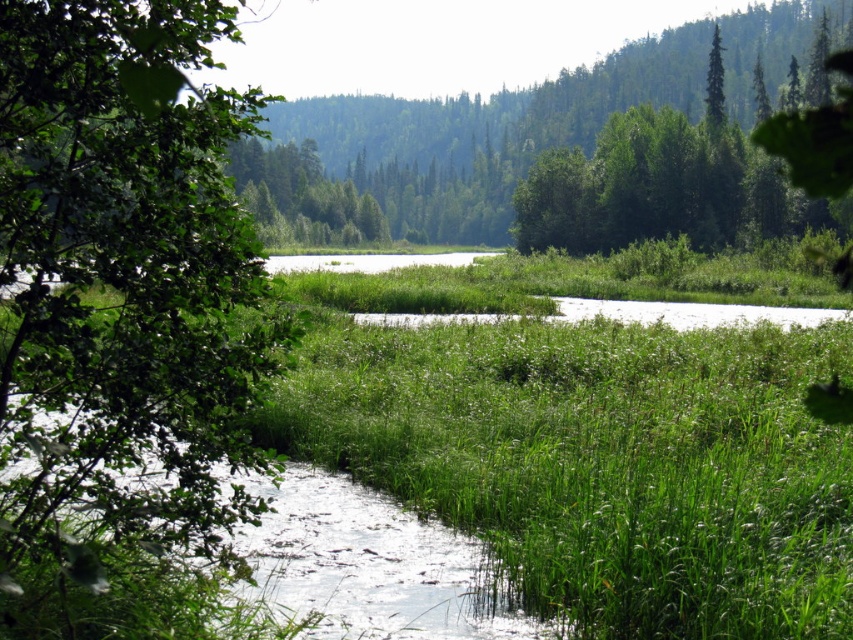
Can you confirm if green leafy tree at left is wider than green leafy tree at upper right?

Correct, the width of green leafy tree at left exceeds that of green leafy tree at upper right.

What do you see at coordinates (125, 328) in the screenshot?
I see `green leafy tree at left` at bounding box center [125, 328].

The width and height of the screenshot is (853, 640). Find the location of `green leafy tree at left`. green leafy tree at left is located at coordinates [125, 328].

Does green grass at center have a lesser width compared to green leafy tree at left?

Yes.

Where is `green grass at center`? The height and width of the screenshot is (640, 853). green grass at center is located at coordinates (560, 481).

Which is behind, point (819, 579) or point (154, 208)?

The point (819, 579) is behind.

Find the location of `green grass at center`. green grass at center is located at coordinates coord(560,481).

Can you confirm if green grass at center is taller than green leafy tree at upper right?

→ No.

Which is behind, point (306, 349) or point (720, 68)?

The point (720, 68) is behind.

Locate an element on the screen. green grass at center is located at coordinates (560, 481).